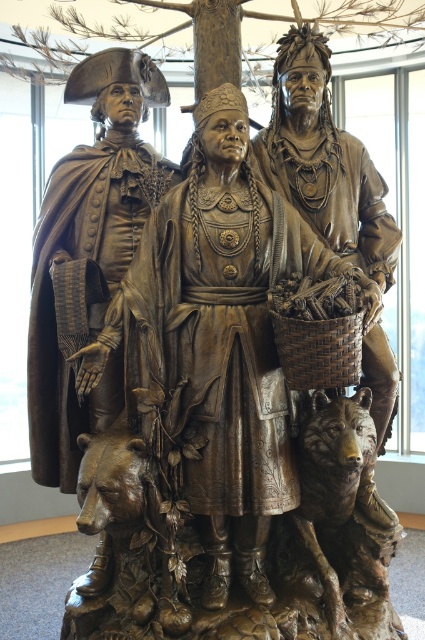
Question: Is bronze statue at center further to camera compared to bronze textured tree trunk at center?

Choices:
 (A) yes
 (B) no

Answer: (B)

Question: Which point is farther to the camera?

Choices:
 (A) bronze statue at center
 (B) bronze textured tree trunk at center

Answer: (B)

Question: Among these points, which one is nearest to the camera?

Choices:
 (A) (399, 29)
 (B) (164, 376)

Answer: (B)

Question: Observing the image, what is the correct spatial positioning of bronze statue at center in reference to bronze textured tree trunk at center?

Choices:
 (A) left
 (B) right

Answer: (B)

Question: Which point is farther from the camera taking this photo?

Choices:
 (A) (207, 8)
 (B) (220, 342)

Answer: (A)

Question: Is bronze statue at center below bronze textured tree trunk at center?

Choices:
 (A) yes
 (B) no

Answer: (A)